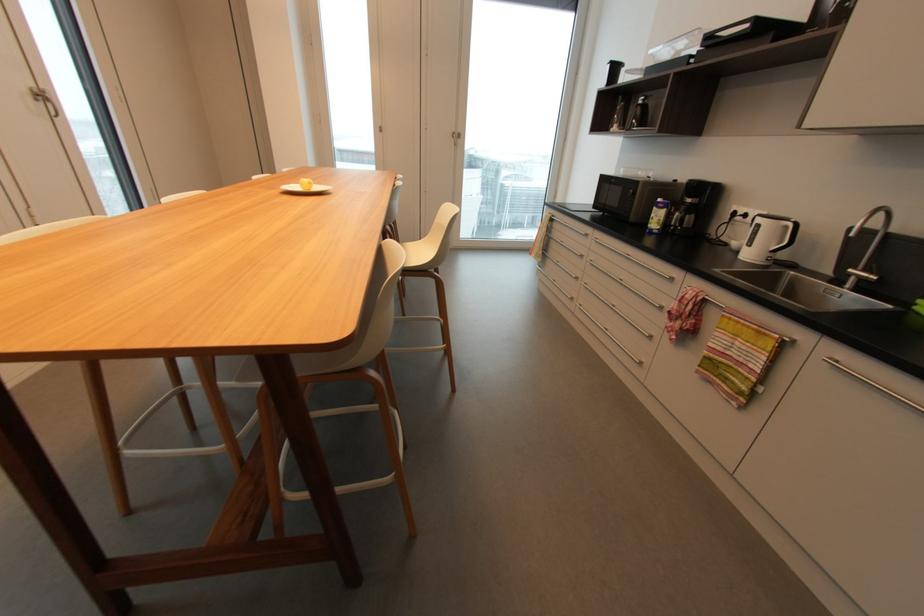
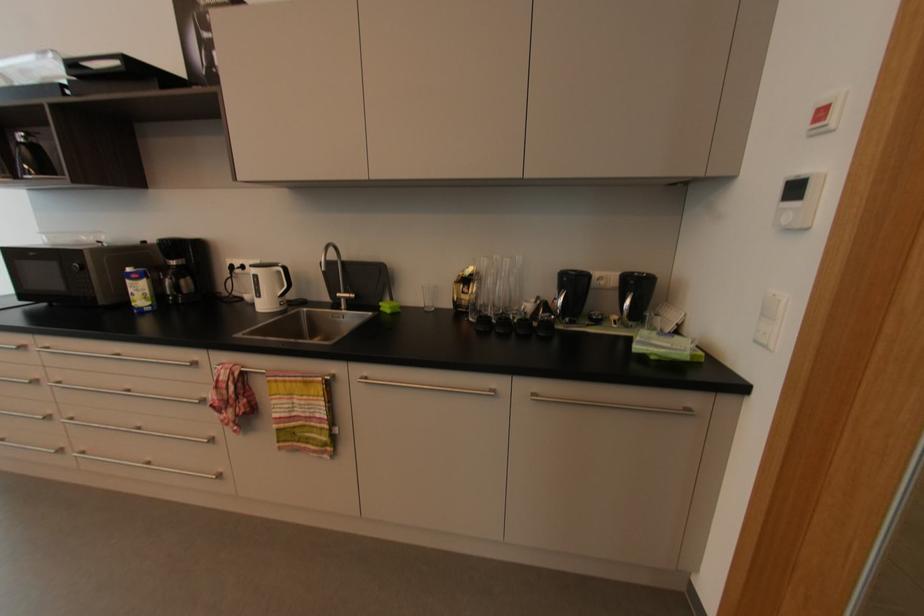
Locate, in the second image, the point that corresponds to the point at 864,280 in the first image.

(350, 300)